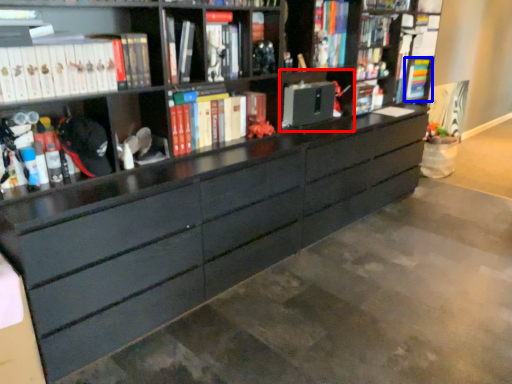
Question: Which of the following is the farthest to the observer, cabinet (highlighted by a red box) or book (highlighted by a blue box)?

Choices:
 (A) cabinet
 (B) book

Answer: (B)